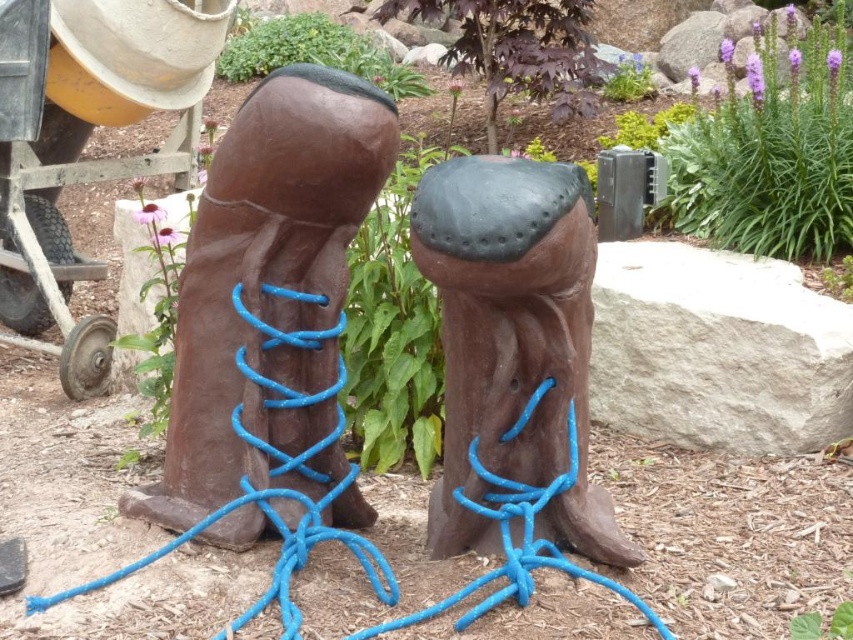
Question: Is brown wood boot at center positioned before brown matte wood at center?

Choices:
 (A) no
 (B) yes

Answer: (A)

Question: Does brown wood boot at center lie in front of brown matte wood at center?

Choices:
 (A) no
 (B) yes

Answer: (A)

Question: Considering the relative positions of brown wood boot at center and brown matte wood at center in the image provided, where is brown wood boot at center located with respect to brown matte wood at center?

Choices:
 (A) right
 (B) left

Answer: (B)

Question: Which point is farther from the camera taking this photo?

Choices:
 (A) (583, 228)
 (B) (231, 404)

Answer: (B)

Question: Among these points, which one is farthest from the camera?

Choices:
 (A) (476, 236)
 (B) (316, 70)

Answer: (B)